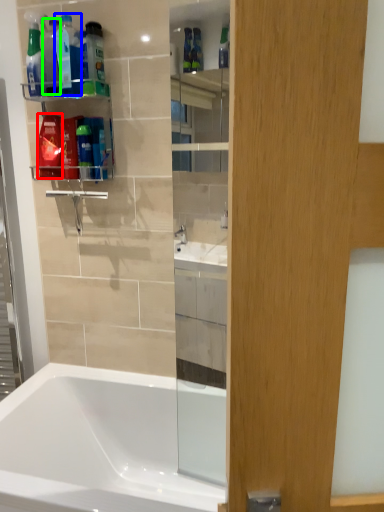
Question: Based on their relative distances, which object is nearer to mouthwash (highlighted by a red box)? Choose from cleaning product (highlighted by a blue box) and bottle (highlighted by a green box).

Choices:
 (A) cleaning product
 (B) bottle

Answer: (B)